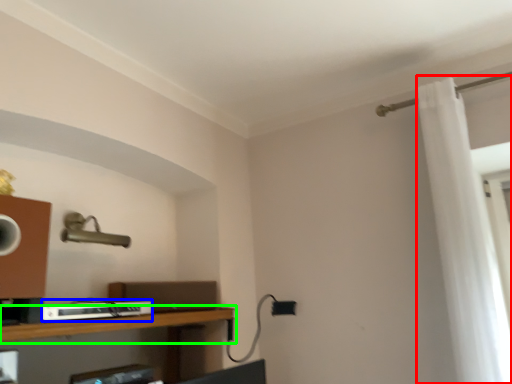
Question: Which object is the closest to the shower curtain (highlighted by a red box)? Choose among these: equipment (highlighted by a blue box) or shelf (highlighted by a green box).

Choices:
 (A) equipment
 (B) shelf

Answer: (B)